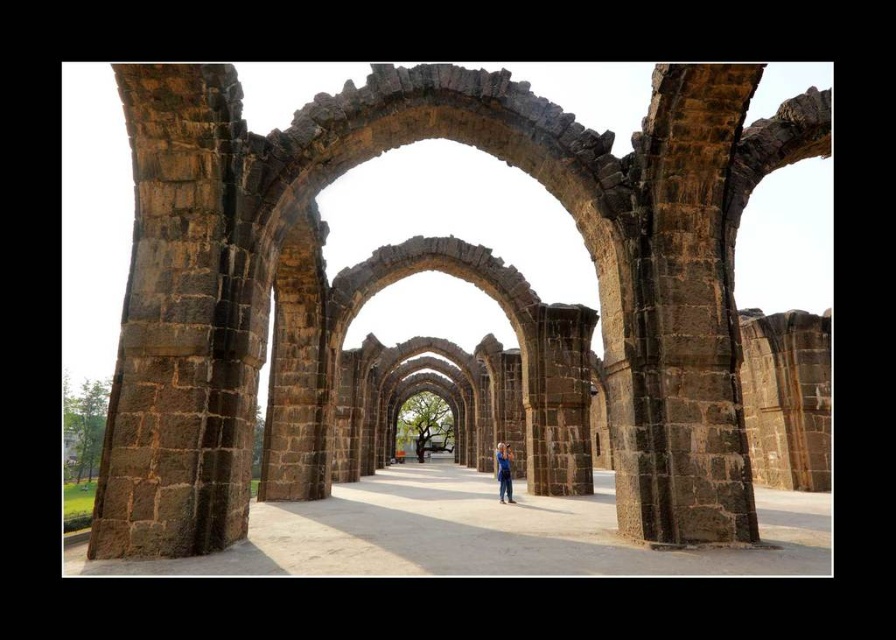
Does smooth concrete path at center appear on the left side of blue denim jeans at center?

Correct, you'll find smooth concrete path at center to the left of blue denim jeans at center.

In the scene shown: Does smooth concrete path at center come behind blue denim jeans at center?

No, smooth concrete path at center is in front of blue denim jeans at center.

Between point (386, 563) and point (506, 497), which one is positioned in front?

Point (386, 563) is in front.

Find the location of a particular element. The image size is (896, 640). smooth concrete path at center is located at coordinates (480, 534).

Who is positioned more to the left, brown stone arches at center or blue denim jeans at center?

Positioned to the left is blue denim jeans at center.

Which is behind, point (227, 257) or point (506, 483)?

The point (506, 483) is more distant.

Which is in front, point (340, 106) or point (497, 476)?

Point (340, 106) is more forward.

Find the location of `brown stone arches at center`. brown stone arches at center is located at coordinates (419, 272).

Which of these two, brown stone arches at center or smooth concrete path at center, stands taller?

brown stone arches at center

Looking at this image, is brown stone arches at center taller than smooth concrete path at center?

Correct, brown stone arches at center is much taller as smooth concrete path at center.

Between point (566, 112) and point (784, 497), which one is positioned behind?

The point (784, 497) is behind.

Find the location of a particular element. brown stone arches at center is located at coordinates (419, 272).